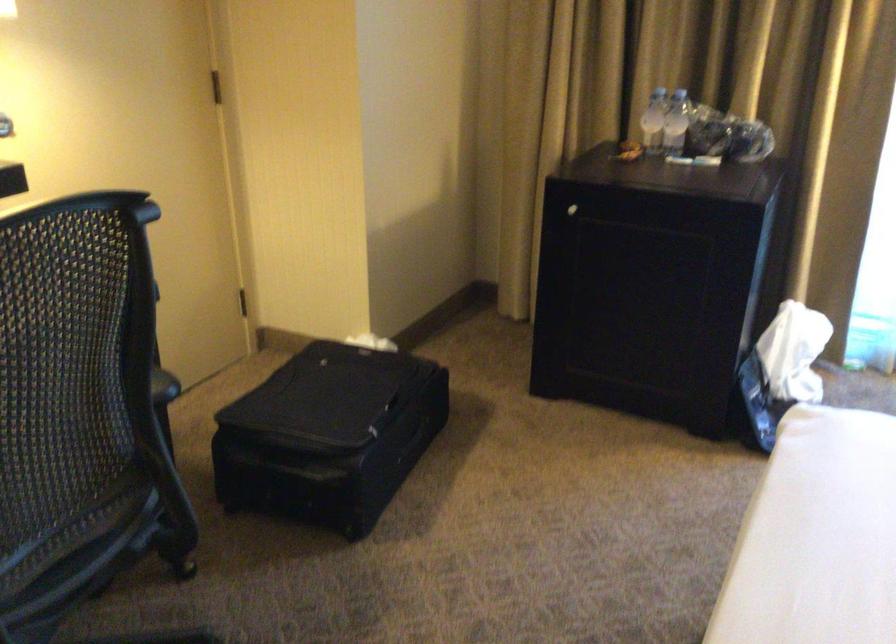
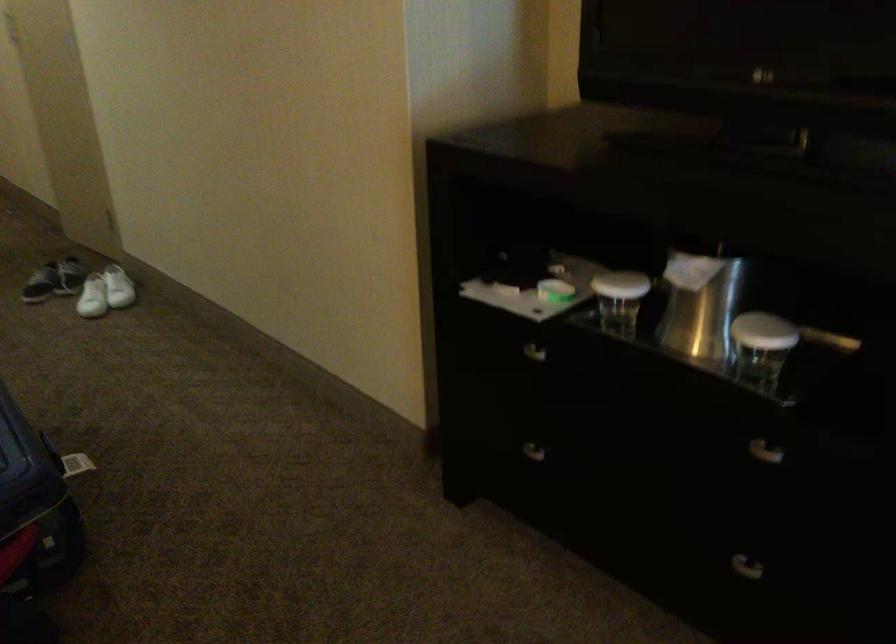
The first image is from the beginning of the video and the second image is from the end. How did the camera likely rotate when shooting the video?

The rotation direction of the camera is left-down.